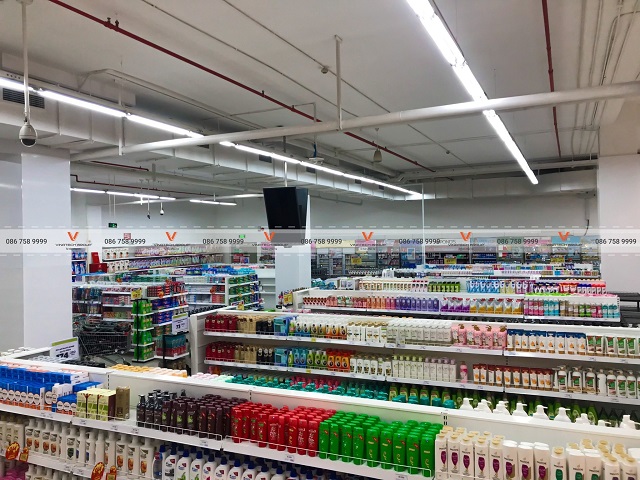
Where is `screen`? screen is located at coordinates (292, 202).